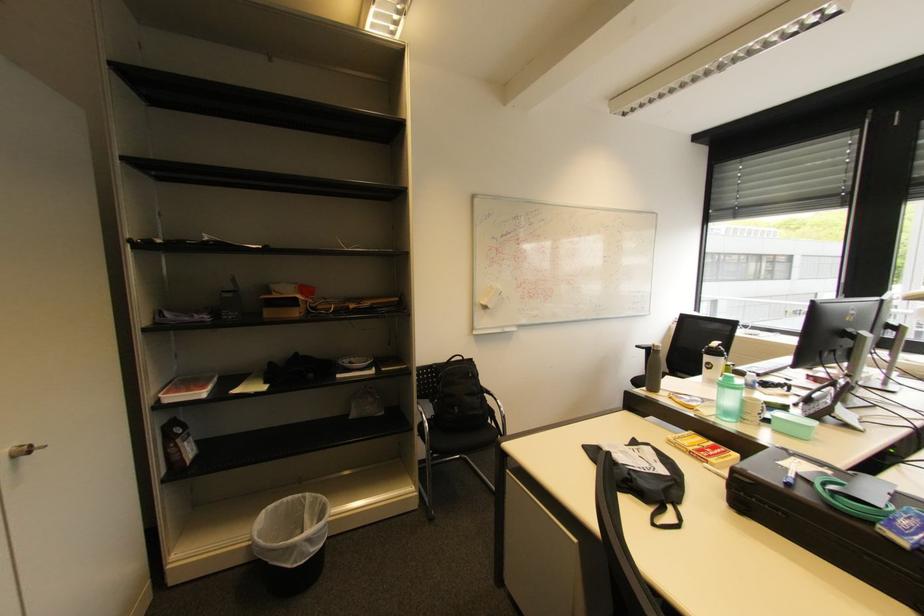
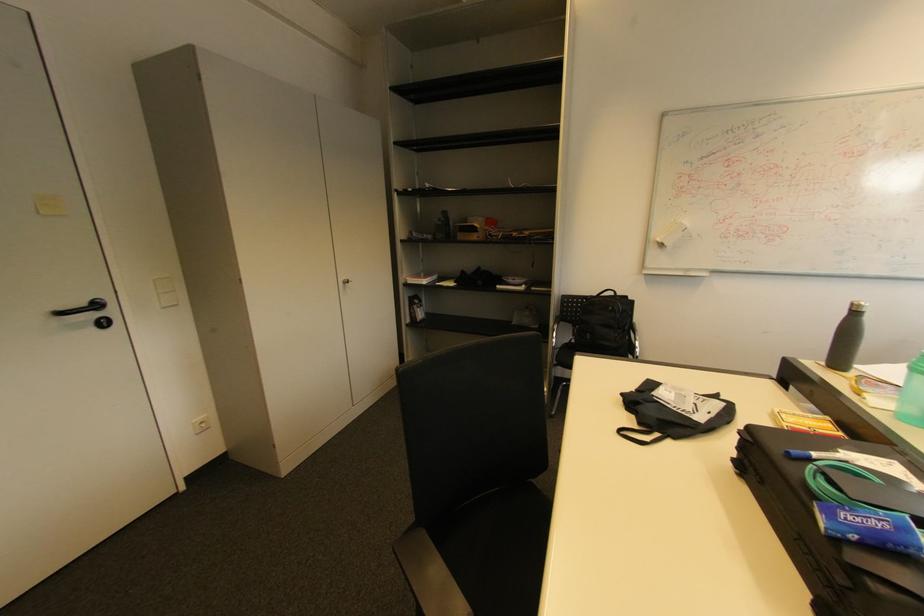
Question: The first image is from the beginning of the video and the second image is from the end. How did the camera likely rotate when shooting the video?

Choices:
 (A) Left
 (B) Right
 (C) Up
 (D) Down

Answer: (A)